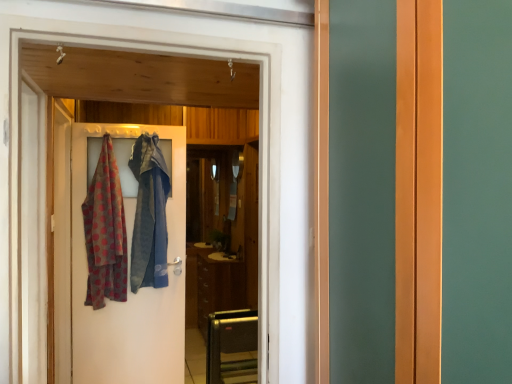
Image resolution: width=512 pixels, height=384 pixels. Describe the element at coordinates (129, 285) in the screenshot. I see `polka dot fabric at left` at that location.

What is the approximate width of brown matte cabinet at center?

18.16 inches.

What do you see at coordinates (218, 287) in the screenshot?
I see `brown matte cabinet at center` at bounding box center [218, 287].

Describe the element at coordinates (259, 162) in the screenshot. This screenshot has width=512, height=384. I see `wooden door at center` at that location.

Locate an element on the screen. Image resolution: width=512 pixels, height=384 pixels. metallic silver toaster at lower center is located at coordinates (231, 343).

Image resolution: width=512 pixels, height=384 pixels. Identify the location of furniture that appears on the right of brown matte cabinet at center. (231, 343).

Does point (210, 264) appear closer or farther from the camera than point (230, 318)?

Point (210, 264) is farther from the camera than point (230, 318).

Between brown matte cabinet at center and metallic silver toaster at lower center, which one has larger size?

brown matte cabinet at center.

From the image's perspective, is polka dot fabric at left above or below wooden door at center?

polka dot fabric at left is below wooden door at center.

Between point (126, 323) and point (267, 357), which one is positioned in front?

Positioned in front is point (267, 357).

Which object is more forward, polka dot fabric at left or wooden door at center?

Positioned in front is wooden door at center.

Could you tell me if polka dot fabric at left is turned towards wooden door at center?

Yes, polka dot fabric at left is oriented towards wooden door at center.

Looking at the image, does metallic silver toaster at lower center seem bigger or smaller compared to brown matte cabinet at center?

Considering their sizes, metallic silver toaster at lower center takes up less space than brown matte cabinet at center.

Could you tell me if metallic silver toaster at lower center is turned towards brown matte cabinet at center?

No.

Which is more to the left, metallic silver toaster at lower center or brown matte cabinet at center?

brown matte cabinet at center.

Considering the positions of points (238, 340) and (213, 271), is point (238, 340) closer to camera compared to point (213, 271)?

Yes, point (238, 340) is in front of point (213, 271).

What's the angular difference between polka dot fabric scarf at left and polka dot fabric at left's facing directions?

The angle between the facing direction of polka dot fabric scarf at left and the facing direction of polka dot fabric at left is 3.8 degrees.

Which of these two, polka dot fabric scarf at left or polka dot fabric at left, stands shorter?

polka dot fabric scarf at left.

Is polka dot fabric scarf at left facing towards polka dot fabric at left?

No, polka dot fabric scarf at left is not facing towards polka dot fabric at left.

Is polka dot fabric scarf at left next to polka dot fabric at left and touching it?

polka dot fabric scarf at left and polka dot fabric at left are not in contact.

From a real-world perspective, is brown matte cabinet at center on top of wooden door at center?

Actually, brown matte cabinet at center is physically below wooden door at center in the real world.

Considering the sizes of objects brown matte cabinet at center and wooden door at center in the image provided, who is wider, brown matte cabinet at center or wooden door at center?

brown matte cabinet at center.

Can you confirm if brown matte cabinet at center is positioned to the right of wooden door at center?

No.

Looking at this image, is brown matte cabinet at center further to camera compared to wooden door at center?

Yes, brown matte cabinet at center is further from the camera.

Locate an element on the screen. clothing that is above the metallic silver toaster at lower center (from the image's perspective) is located at coordinates (105, 232).

Can you confirm if metallic silver toaster at lower center is taller than polka dot fabric scarf at left?

Incorrect, the height of metallic silver toaster at lower center is not larger of that of polka dot fabric scarf at left.

Who is smaller, metallic silver toaster at lower center or polka dot fabric scarf at left?

Smaller between the two is polka dot fabric scarf at left.

Is metallic silver toaster at lower center positioned with its back to polka dot fabric scarf at left?

No, metallic silver toaster at lower center is not facing away from polka dot fabric scarf at left.

Is wooden door at center facing towards brown matte cabinet at center?

No.

Between wooden door at center and brown matte cabinet at center, which one is positioned behind?

brown matte cabinet at center is behind.

Find the location of `elevator that is on the right side of brown matte cabinet at center`. elevator that is on the right side of brown matte cabinet at center is located at coordinates (259, 162).

At what (x,y) coordinates should I click in order to perform the action: click on cabinetry behind the metallic silver toaster at lower center. Please return your answer as a coordinate pair (x, y). Looking at the image, I should click on (218, 287).

At what (x,y) coordinates should I click in order to perform the action: click on door below the wooden door at center (from the image's perspective). Please return your answer as a coordinate pair (x, y). Looking at the image, I should click on (129, 285).

Considering their positions, is brown matte cabinet at center positioned closer to polka dot fabric at left than polka dot fabric scarf at left?

polka dot fabric scarf at left is positioned closer to the anchor polka dot fabric at left.

Which object lies nearer to the anchor point wooden door at center, metallic silver toaster at lower center or polka dot fabric scarf at left?

polka dot fabric scarf at left lies closer to wooden door at center than the other object.

When comparing their distances from polka dot fabric scarf at left, does wooden door at center or polka dot fabric at left seem further?

wooden door at center is positioned further to the anchor polka dot fabric scarf at left.

From the image, which object appears to be farther from metallic silver toaster at lower center, wooden door at center or polka dot fabric at left?

wooden door at center.

Based on their spatial positions, is metallic silver toaster at lower center or polka dot fabric scarf at left further from brown matte cabinet at center?

polka dot fabric scarf at left lies further to brown matte cabinet at center than the other object.

Which object lies further to the anchor point brown matte cabinet at center, polka dot fabric at left or metallic silver toaster at lower center?

polka dot fabric at left lies further to brown matte cabinet at center than the other object.

When comparing their distances from brown matte cabinet at center, does metallic silver toaster at lower center or wooden door at center seem closer?

metallic silver toaster at lower center is closer to brown matte cabinet at center.

Which object lies nearer to the anchor point metallic silver toaster at lower center, polka dot fabric at left or brown matte cabinet at center?

polka dot fabric at left.

The width and height of the screenshot is (512, 384). I want to click on furniture located between polka dot fabric at left and brown matte cabinet at center in the depth direction, so click(231, 343).

Identify the location of clothing between wooden door at center and metallic silver toaster at lower center in the front-back direction. (105, 232).

Where is `door between polka dot fabric scarf at left and metallic silver toaster at lower center in the vertical direction`? door between polka dot fabric scarf at left and metallic silver toaster at lower center in the vertical direction is located at coordinates click(x=129, y=285).

Find the location of a particular element. Image resolution: width=512 pixels, height=384 pixels. door between wooden door at center and metallic silver toaster at lower center in the front-back direction is located at coordinates (129, 285).